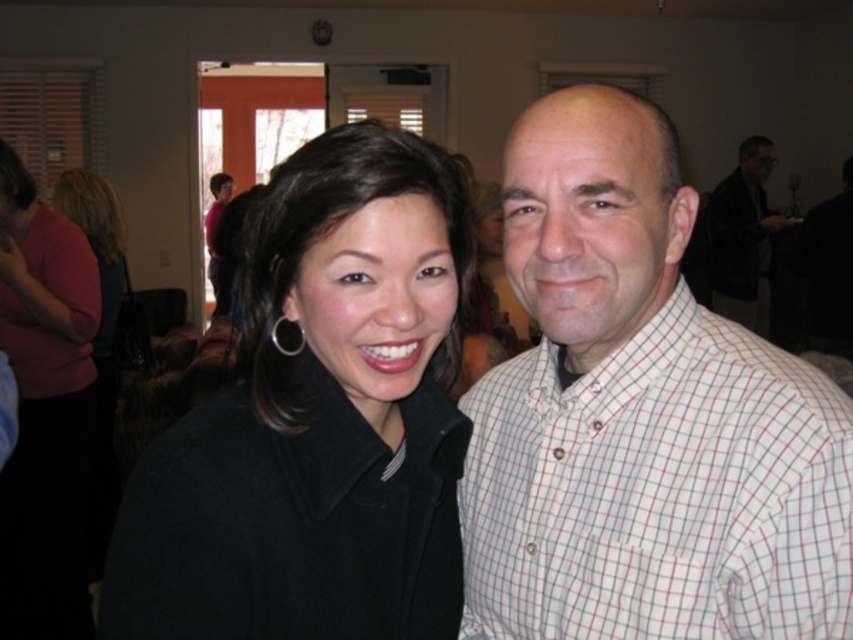
You are standing in front of the image and want to determine which of the two points, point (16, 385) or point (753, 134), is nearer to you. Based on the scene, which point is closer?

Point (16, 385) is closer to the viewer than point (753, 134).